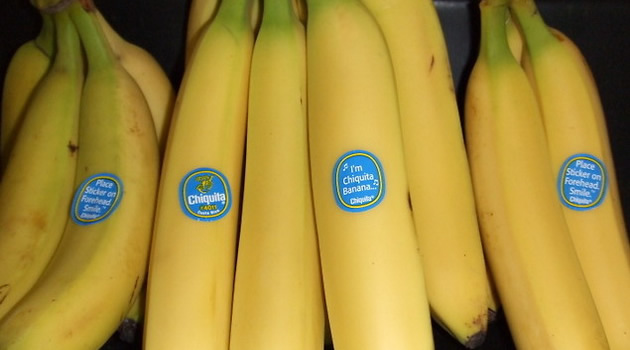
The image size is (630, 350). Identify the location of stickers. (96, 199), (215, 202), (346, 185), (575, 181).